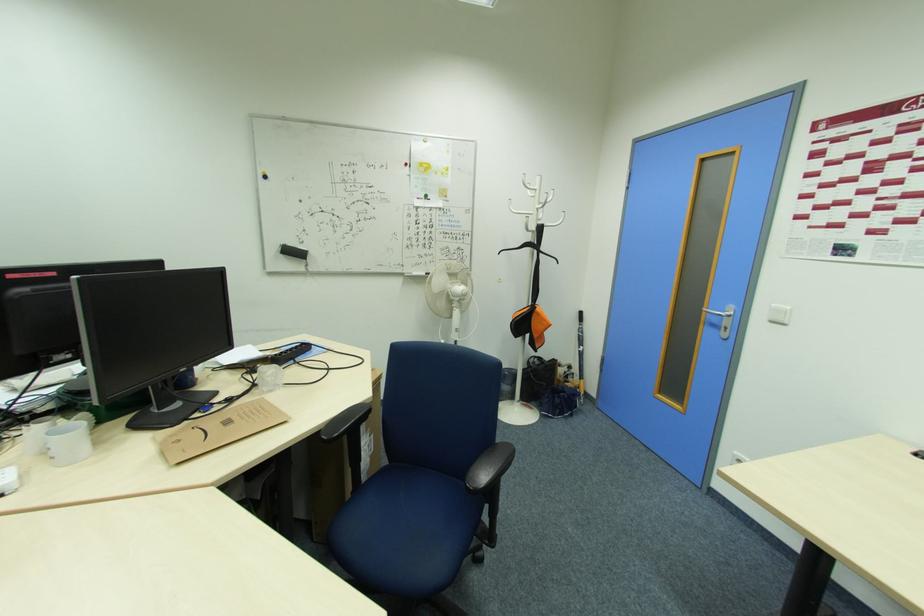
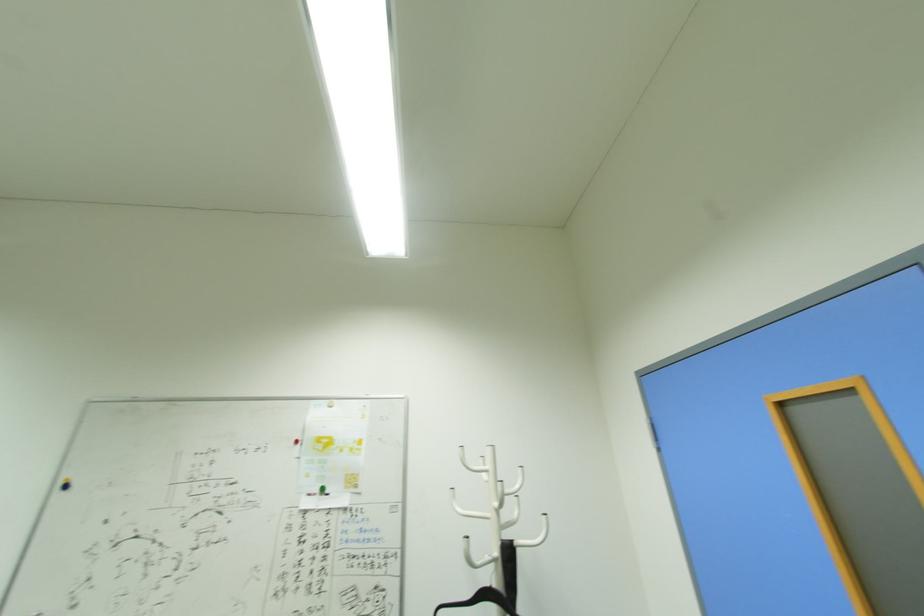
In the second image, find the point that corresponds to point 537,198 in the first image.

(492, 484)